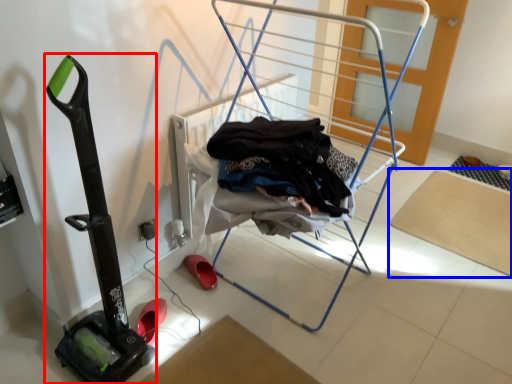
Question: Which object appears closest to the camera in this image, vacuum (highlighted by a red box) or yoga mat (highlighted by a blue box)?

Choices:
 (A) vacuum
 (B) yoga mat

Answer: (A)